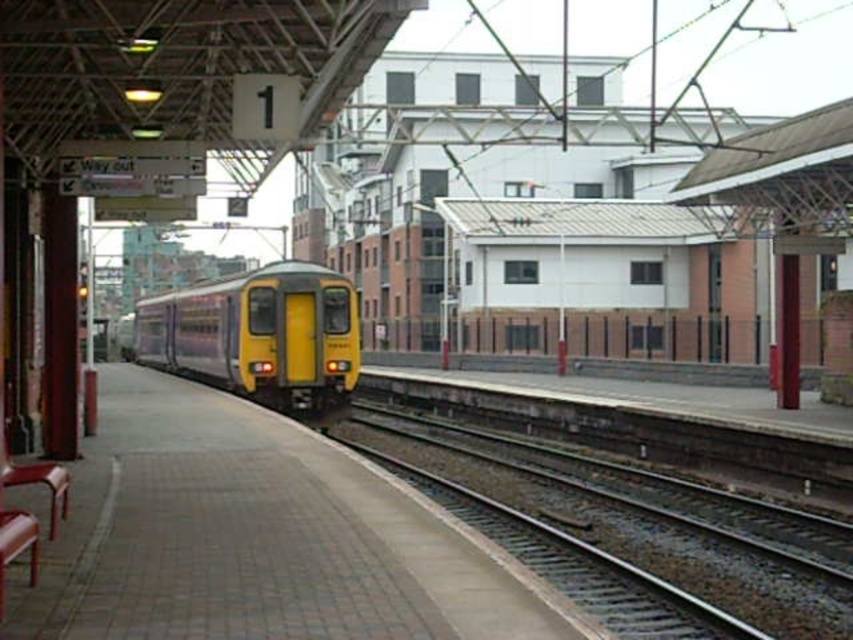
You are a maintenance worker needing to reach the yellow matte train at center for repairs. The safety regulations state that you can only work within 50 feet of the platform edge. Are you within the safe distance if you start from the smooth concrete platform at center?

The distance between the smooth concrete platform at center and the yellow matte train at center is 50.12 feet, which exceeds the 50 feet safety regulation limit. Therefore, you are not within the safe distance.

You are a maintenance worker needing to cross from the smooth concrete platform at center to the smooth metal track at center. Given that your tool box is 5 meters wide, will you be able to carry it horizontally without tilting it? Please explain your reasoning based on the distance between them.

The smooth concrete platform at center and smooth metal track at center are 4.96 meters apart. Since the tool box is 5 meters wide, which is slightly wider than the distance between them, you won let carry it horizontally without tilting it. You would need to tilt the box or find another way to transport it.